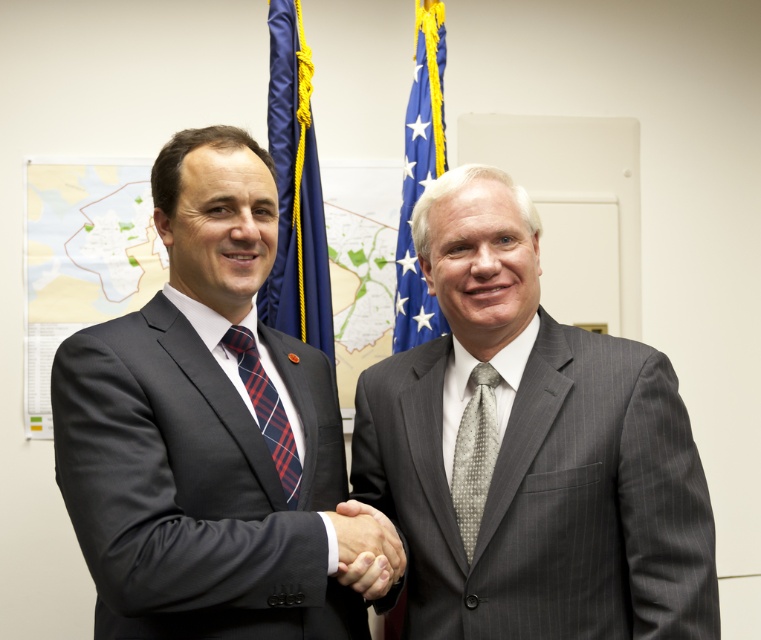
Question: Which point appears farthest from the camera in this image?

Choices:
 (A) (303, 285)
 (B) (293, 490)

Answer: (A)

Question: Considering the relative positions of gray pinstripe suit at center and blue fabric flag at upper center in the image provided, where is gray pinstripe suit at center located with respect to blue fabric flag at upper center?

Choices:
 (A) below
 (B) above

Answer: (A)

Question: Considering the relative positions of blue fabric flag at left and smooth skin handshake at center in the image provided, where is blue fabric flag at left located with respect to smooth skin handshake at center?

Choices:
 (A) right
 (B) left

Answer: (B)

Question: Considering the real-world distances, which object is farthest from the smooth skin handshake at center?

Choices:
 (A) gray pinstripe suit at center
 (B) blue fabric flag at left
 (C) dark gray suit at center
 (D) gray dotted tie at center

Answer: (B)

Question: Observing the image, what is the correct spatial positioning of gray pinstripe suit at center in reference to blue fabric flag at upper center?

Choices:
 (A) right
 (B) left

Answer: (A)

Question: Estimate the real-world distances between objects in this image. Which object is farther from the blue fabric flag at upper center?

Choices:
 (A) smooth skin handshake at center
 (B) gray dotted tie at center
 (C) gray pinstripe suit at center
 (D) plaid fabric tie at center

Answer: (A)